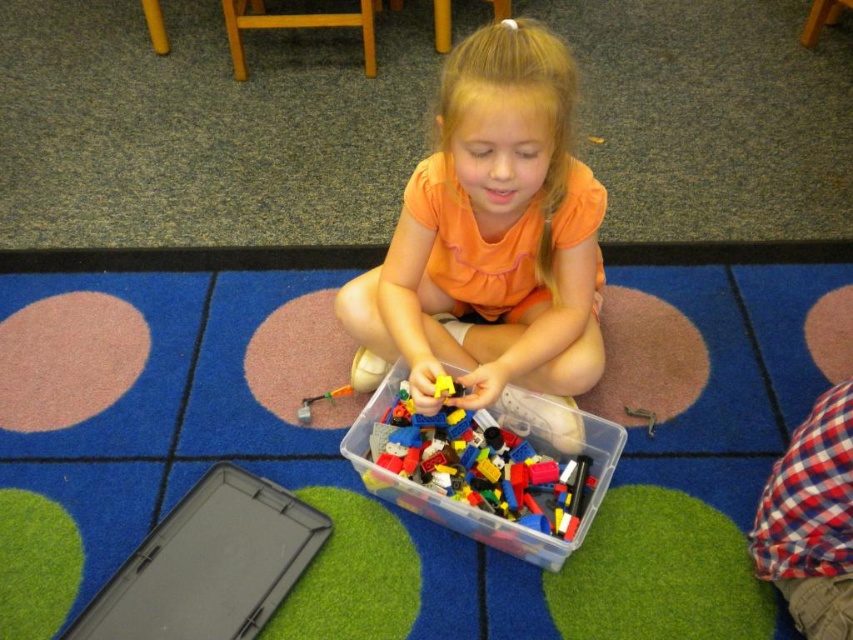
Who is more forward, (635, 323) or (820, 538)?

Point (820, 538) is in front.

At what (x,y) coordinates should I click in order to perform the action: click on blue carpet at center. Please return your answer as a coordinate pair (x, y). This screenshot has width=853, height=640. Looking at the image, I should click on (358, 481).

Which is behind, point (796, 468) or point (309, 406)?

Positioned behind is point (309, 406).

Can you confirm if red plaid shirt at lower right is shorter than translucent plastic tool at lower center?

In fact, red plaid shirt at lower right may be taller than translucent plastic tool at lower center.

Does point (762, 515) come behind point (305, 406)?

No.

In order to click on red plaid shirt at lower right in this screenshot , I will do click(x=811, y=520).

Based on the photo, who is taller, translucent plastic container at center or translucent plastic tool at lower center?

Standing taller between the two is translucent plastic container at center.

Is translucent plastic container at center wider than translucent plastic tool at lower center?

Correct, the width of translucent plastic container at center exceeds that of translucent plastic tool at lower center.

Between point (531, 474) and point (312, 401), which one is positioned in front?

Positioned in front is point (531, 474).

Locate an element on the screen. This screenshot has width=853, height=640. translucent plastic container at center is located at coordinates (482, 465).